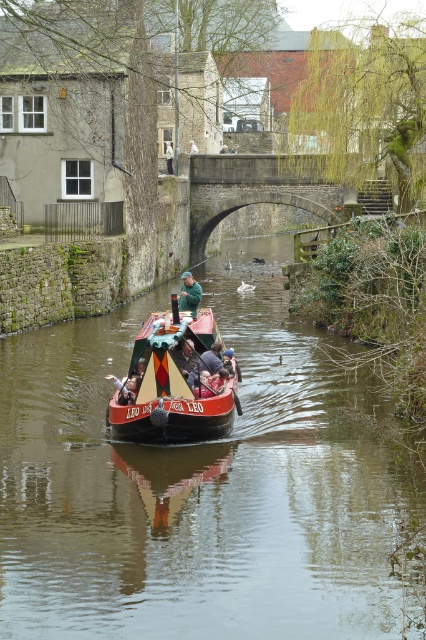
Question: Considering the real-world distances, which object is closest to the dark gray stone bridge at center?

Choices:
 (A) matte black hat at center
 (B) white cotton shirt at center

Answer: (B)

Question: Estimate the real-world distances between objects in this image. Which object is closer to the dark gray stone bridge at center?

Choices:
 (A) green matte jacket at center
 (B) polished wood boat at center

Answer: (A)

Question: Does dark gray stone bridge at center appear under white cotton shirt at center?

Choices:
 (A) no
 (B) yes

Answer: (B)

Question: Can you confirm if dark gray stone bridge at center is thinner than matte black jacket at center?

Choices:
 (A) yes
 (B) no

Answer: (B)

Question: Among these points, which one is farthest from the camera?

Choices:
 (A) (219, 372)
 (B) (215, 358)
 (C) (178, 305)
 (D) (186, 364)

Answer: (C)

Question: Can you confirm if smooth brown water at center is positioned above matte black hat at center?

Choices:
 (A) yes
 (B) no

Answer: (B)